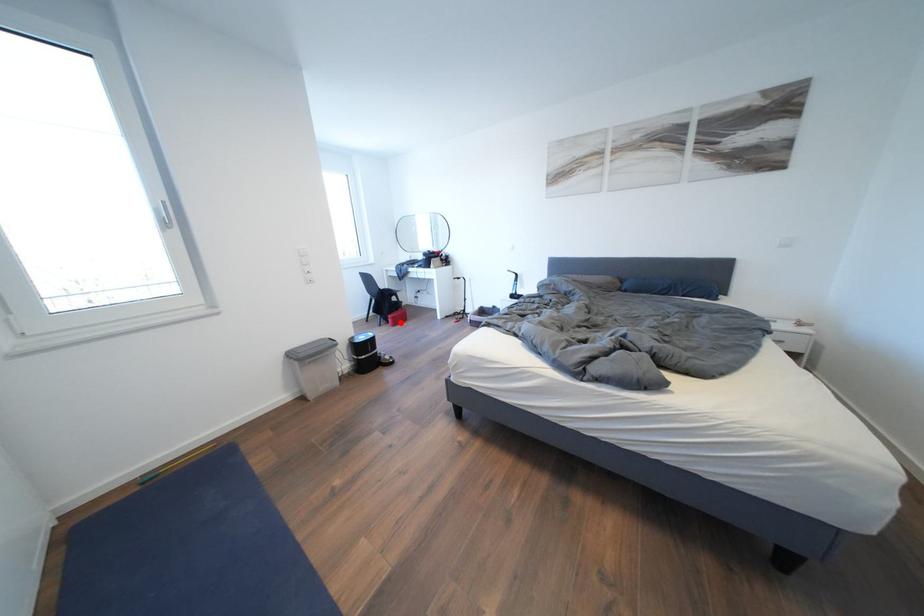
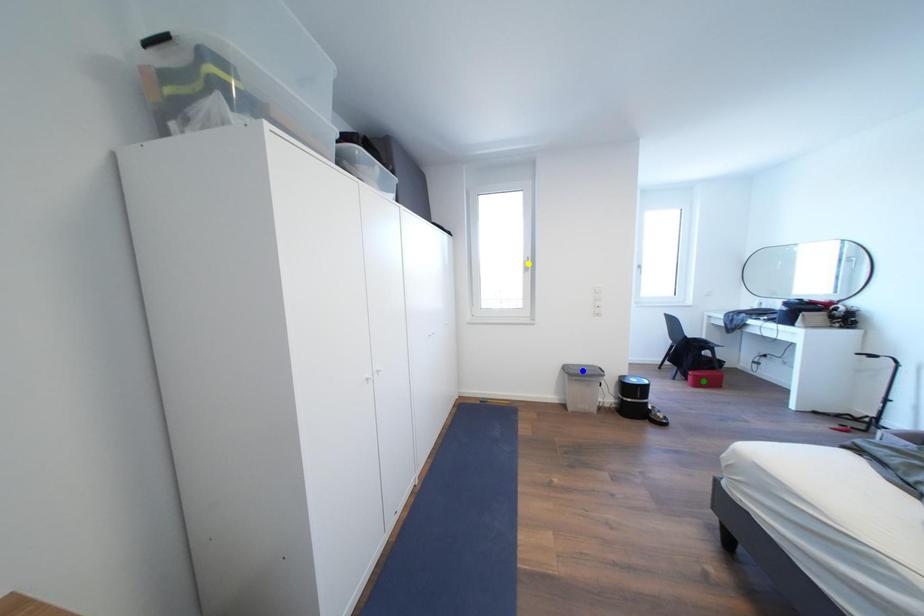
Question: I am providing you with two images of the same scene from different viewpoints. A red point is marked on the first image. You are given multiple points on the second image. Which spot in image 2 lines up with the point in image 1?

Choices:
 (A) blue point
 (B) green point
 (C) yellow point

Answer: (B)